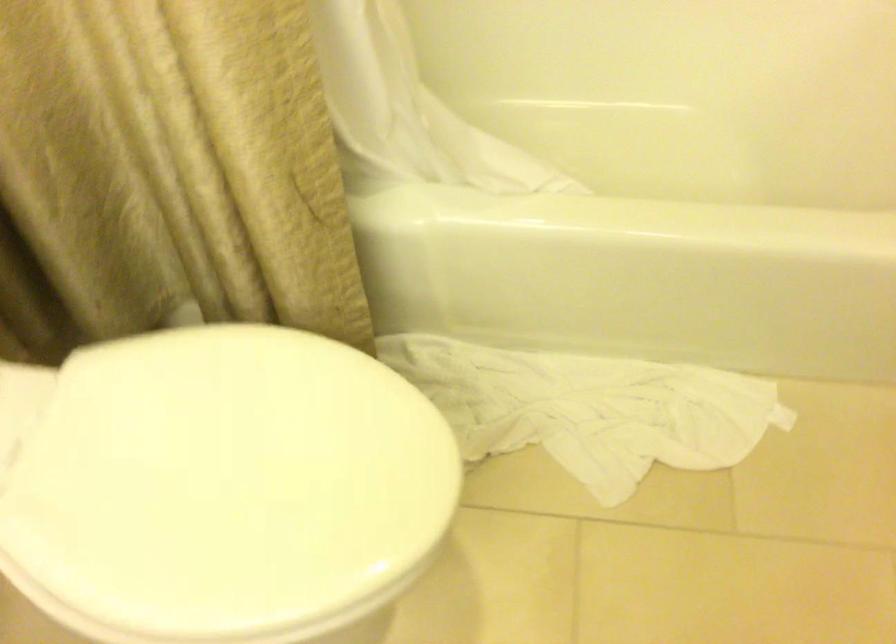
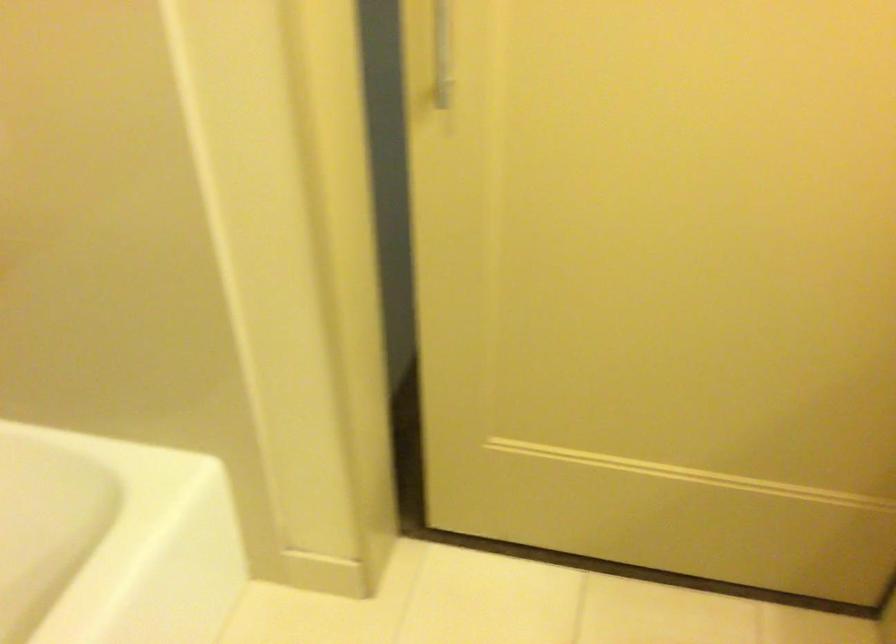
Question: The images are taken continuously from a first-person perspective. In which direction is your viewpoint rotating?

Choices:
 (A) Left
 (B) Right
 (C) Up
 (D) Down

Answer: (B)